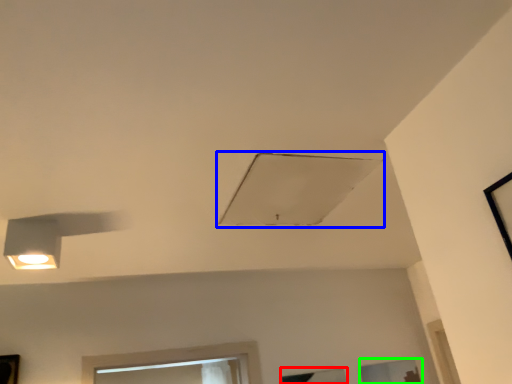
Question: Based on their relative distances, which object is nearer to window (highlighted by a red box)? Choose from exhaust hood (highlighted by a blue box) and window (highlighted by a green box).

Choices:
 (A) exhaust hood
 (B) window

Answer: (B)